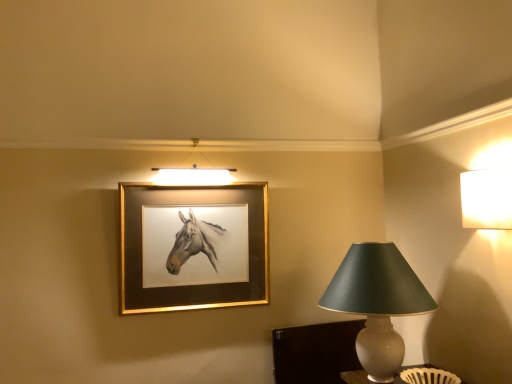
The image size is (512, 384). Find the location of `matte gray lampshade at right, placed as the second lamp when sorted from right to left`. matte gray lampshade at right, placed as the second lamp when sorted from right to left is located at coordinates (377, 303).

In order to click on gold metallic picture frame at upper center in this screenshot , I will do `click(193, 246)`.

Can you confirm if white textured lampshade at upper right, arranged as the first lamp when viewed from the right, is taller than matte gray lampshade at right, placed as the second lamp when sorted from right to left?

No, white textured lampshade at upper right, arranged as the first lamp when viewed from the right, is not taller than matte gray lampshade at right, placed as the second lamp when sorted from right to left.

Is white textured lampshade at upper right, which appears as the second lamp when viewed from the left, looking in the opposite direction of matte gray lampshade at right, acting as the second lamp starting from the top?

No.

Between white textured lampshade at upper right, arranged as the first lamp when viewed from the right, and matte gray lampshade at right, placed as the second lamp when sorted from right to left, which one appears on the left side from the viewer's perspective?

From the viewer's perspective, matte gray lampshade at right, placed as the second lamp when sorted from right to left, appears more on the left side.

Is white textured lampshade at upper right, placed as the second lamp when sorted from bottom to top, positioned far away from matte gray lampshade at right, placed as the second lamp when sorted from right to left?

That's not correct — white textured lampshade at upper right, placed as the second lamp when sorted from bottom to top, is a little close to matte gray lampshade at right, placed as the second lamp when sorted from right to left.

From their relative heights in the image, would you say white textured lampshade at upper right, arranged as the first lamp when viewed from the right, is taller or shorter than gold metallic picture frame at upper center?

white textured lampshade at upper right, arranged as the first lamp when viewed from the right, is shorter than gold metallic picture frame at upper center.

Measure the distance from white textured lampshade at upper right, placed as the second lamp when sorted from bottom to top, to gold metallic picture frame at upper center.

The distance of white textured lampshade at upper right, placed as the second lamp when sorted from bottom to top, from gold metallic picture frame at upper center is 3.34 feet.

From the image's perspective, does white textured lampshade at upper right, the 1th lamp when ordered from top to bottom, appear lower than gold metallic picture frame at upper center?

No, from the image's perspective, white textured lampshade at upper right, the 1th lamp when ordered from top to bottom, is not beneath gold metallic picture frame at upper center.

Considering the relative sizes of white textured lampshade at upper right, placed as the second lamp when sorted from bottom to top, and gold metallic picture frame at upper center in the image provided, is white textured lampshade at upper right, placed as the second lamp when sorted from bottom to top, smaller than gold metallic picture frame at upper center?

Indeed, white textured lampshade at upper right, placed as the second lamp when sorted from bottom to top, has a smaller size compared to gold metallic picture frame at upper center.

Considering the relative sizes of matte gray lampshade at right, placed as the second lamp when sorted from right to left, and gold metallic picture frame at upper center in the image provided, is matte gray lampshade at right, placed as the second lamp when sorted from right to left, thinner than gold metallic picture frame at upper center?

No, matte gray lampshade at right, placed as the second lamp when sorted from right to left, is not thinner than gold metallic picture frame at upper center.

Considering the sizes of objects matte gray lampshade at right, placed as the second lamp when sorted from right to left, and gold metallic picture frame at upper center in the image provided, who is smaller, matte gray lampshade at right, placed as the second lamp when sorted from right to left, or gold metallic picture frame at upper center?

gold metallic picture frame at upper center.

Identify the location of picture frame above the matte gray lampshade at right, acting as the second lamp starting from the top (from a real-world perspective). (193, 246).

Consider the image. Is matte gray lampshade at right, acting as the second lamp starting from the top, inside or outside of gold metallic picture frame at upper center?

matte gray lampshade at right, acting as the second lamp starting from the top, is not enclosed by gold metallic picture frame at upper center.

Consider the image. Which object is further away from the camera taking this photo, gold metallic picture frame at upper center or white textured lampshade at upper right, arranged as the first lamp when viewed from the right?

gold metallic picture frame at upper center is more distant.

Find the location of a particular element. picture frame behind the white textured lampshade at upper right, arranged as the first lamp when viewed from the right is located at coordinates (193, 246).

From the image's perspective, relative to white textured lampshade at upper right, placed as the second lamp when sorted from bottom to top, is gold metallic picture frame at upper center above or below?

gold metallic picture frame at upper center is situated lower than white textured lampshade at upper right, placed as the second lamp when sorted from bottom to top, in the image.

Based on their sizes in the image, would you say gold metallic picture frame at upper center is bigger or smaller than white textured lampshade at upper right, arranged as the first lamp when viewed from the right?

Considering their sizes, gold metallic picture frame at upper center takes up more space than white textured lampshade at upper right, arranged as the first lamp when viewed from the right.

Is gold metallic picture frame at upper center facing towards matte gray lampshade at right, acting as the second lamp starting from the top?

No, gold metallic picture frame at upper center is not facing towards matte gray lampshade at right, acting as the second lamp starting from the top.

Does point (256, 254) lie in front of point (374, 293)?

That is False.

From the image's perspective, is gold metallic picture frame at upper center located above matte gray lampshade at right, which is the 1th lamp in left-to-right order?

Correct, gold metallic picture frame at upper center appears higher than matte gray lampshade at right, which is the 1th lamp in left-to-right order, in the image.

Considering the relative sizes of gold metallic picture frame at upper center and matte gray lampshade at right, which is the 1th lamp in left-to-right order, in the image provided, is gold metallic picture frame at upper center thinner than matte gray lampshade at right, which is the 1th lamp in left-to-right order,?

Indeed, gold metallic picture frame at upper center has a lesser width compared to matte gray lampshade at right, which is the 1th lamp in left-to-right order.

Who is smaller, matte gray lampshade at right, the first lamp ordered from the bottom, or white textured lampshade at upper right, arranged as the first lamp when viewed from the right?

With smaller size is white textured lampshade at upper right, arranged as the first lamp when viewed from the right.

Which object is positioned more to the left, matte gray lampshade at right, which is the 1th lamp in left-to-right order, or white textured lampshade at upper right, placed as the second lamp when sorted from bottom to top?

From the viewer's perspective, matte gray lampshade at right, which is the 1th lamp in left-to-right order, appears more on the left side.

Where is `lamp on the left side of white textured lampshade at upper right, which appears as the second lamp when viewed from the left`? The image size is (512, 384). lamp on the left side of white textured lampshade at upper right, which appears as the second lamp when viewed from the left is located at coordinates (377, 303).

Locate an element on the screen. This screenshot has height=384, width=512. lamp located in front of the matte gray lampshade at right, which is the 1th lamp in left-to-right order is located at coordinates (486, 199).

Find the location of a particular element. The image size is (512, 384). picture frame to the left of white textured lampshade at upper right, arranged as the first lamp when viewed from the right is located at coordinates (193, 246).

From the image, which object appears to be nearer to gold metallic picture frame at upper center, matte gray lampshade at right, the first lamp ordered from the bottom, or white textured lampshade at upper right, arranged as the first lamp when viewed from the right?

matte gray lampshade at right, the first lamp ordered from the bottom, lies closer to gold metallic picture frame at upper center than the other object.

From the image, which object appears to be nearer to matte gray lampshade at right, acting as the second lamp starting from the top, gold metallic picture frame at upper center or white textured lampshade at upper right, placed as the second lamp when sorted from bottom to top?

The object closer to matte gray lampshade at right, acting as the second lamp starting from the top, is white textured lampshade at upper right, placed as the second lamp when sorted from bottom to top.

Based on their spatial positions, is matte gray lampshade at right, acting as the second lamp starting from the top, or gold metallic picture frame at upper center closer to white textured lampshade at upper right, placed as the second lamp when sorted from bottom to top?

matte gray lampshade at right, acting as the second lamp starting from the top, lies closer to white textured lampshade at upper right, placed as the second lamp when sorted from bottom to top, than the other object.

Looking at the image, which one is located closer to matte gray lampshade at right, the first lamp ordered from the bottom, white textured lampshade at upper right, the 1th lamp when ordered from top to bottom, or gold metallic picture frame at upper center?

white textured lampshade at upper right, the 1th lamp when ordered from top to bottom, is positioned closer to the anchor matte gray lampshade at right, the first lamp ordered from the bottom.

From the image, which object appears to be nearer to white textured lampshade at upper right, which appears as the second lamp when viewed from the left, gold metallic picture frame at upper center or matte gray lampshade at right, placed as the second lamp when sorted from right to left?

matte gray lampshade at right, placed as the second lamp when sorted from right to left, is closer to white textured lampshade at upper right, which appears as the second lamp when viewed from the left.

Looking at this image, considering their positions, is white textured lampshade at upper right, which appears as the second lamp when viewed from the left, positioned further to gold metallic picture frame at upper center than matte gray lampshade at right, acting as the second lamp starting from the top?

Among the two, white textured lampshade at upper right, which appears as the second lamp when viewed from the left, is located further to gold metallic picture frame at upper center.

The height and width of the screenshot is (384, 512). In order to click on lamp between gold metallic picture frame at upper center and white textured lampshade at upper right, which appears as the second lamp when viewed from the left in this screenshot , I will do `click(377, 303)`.